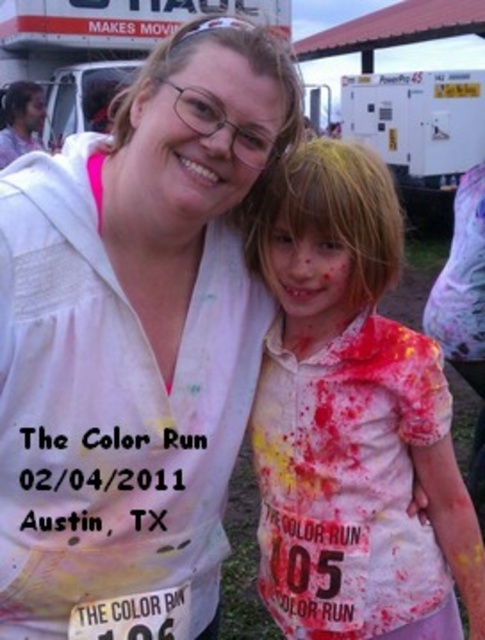
Between white matte shirt at upper left and matte white face at center, which one appears on the left side from the viewer's perspective?

Positioned to the left is white matte shirt at upper left.

Does point (38, 586) come behind point (134, 156)?

That is True.

Is point (152, 294) positioned in front of point (241, 195)?

No, it is behind (241, 195).

You are a GUI agent. You are given a task and a screenshot of the screen. Output one action in this format:
    pyautogui.click(x=<x>, y=<y>)
    Task: Click on the white matte shirt at upper left
    
    Given the screenshot: What is the action you would take?
    pyautogui.click(x=134, y=333)

Is white matte shirt at upper left above matte white face at upper center?

Incorrect, white matte shirt at upper left is not positioned above matte white face at upper center.

Who is positioned more to the right, white matte shirt at upper left or matte white face at upper center?

white matte shirt at upper left is more to the right.

Identify the location of white matte shirt at upper left. Image resolution: width=485 pixels, height=640 pixels. (134, 333).

Who is higher up, matte white face at center or matte white face at upper center?

→ matte white face at upper center is above.

Who is more distant from viewer, (132,100) or (32,108)?

Point (32,108)

Where is `matte white face at center`? matte white face at center is located at coordinates 200,136.